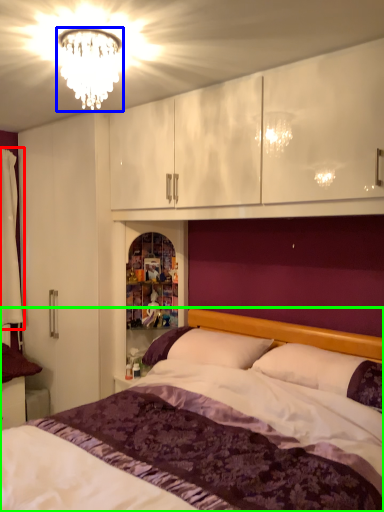
Question: Which object is positioned farthest from curtain (highlighted by a red box)? Select from fixture (highlighted by a blue box) and bed (highlighted by a green box).

Choices:
 (A) fixture
 (B) bed

Answer: (B)